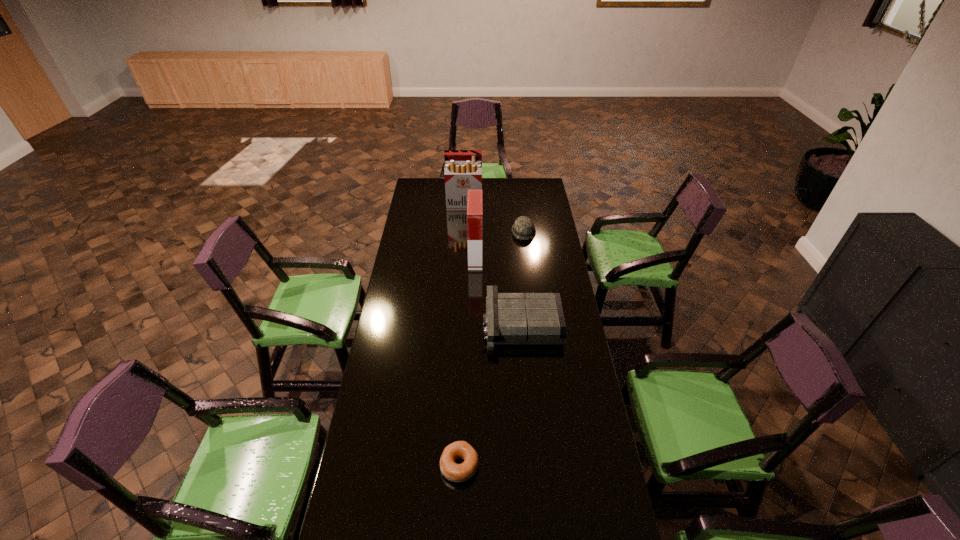
The image size is (960, 540). What are the coordinates of `the farther cigarette_case` in the screenshot? It's located at (463, 168).

Locate an element on the screen. The height and width of the screenshot is (540, 960). the nearer cigarette_case is located at coordinates (474, 201).

Identify the location of radio receiver. The height and width of the screenshot is (540, 960). (511, 318).

Locate an element on the screen. This screenshot has height=540, width=960. headwear is located at coordinates (523, 228).

This screenshot has height=540, width=960. Identify the location of the shortest object. (453, 472).

This screenshot has width=960, height=540. In order to click on bagel in this screenshot , I will do `click(453, 472)`.

Identify the location of vacant region located with the lid open on the farther cigarette_case. (463, 243).

At what (x,y) coordinates should I click in order to perform the action: click on vacant space located on the front-facing side of the nearer cigarette_case. Please return your answer as a coordinate pair (x, y). The height and width of the screenshot is (540, 960). Looking at the image, I should click on (492, 256).

Find the location of a particular element. vacant area situated on the front panel of the radio receiver is located at coordinates pyautogui.click(x=416, y=324).

Identify the location of free region located 0.080m on the front panel of the radio receiver. (465, 324).